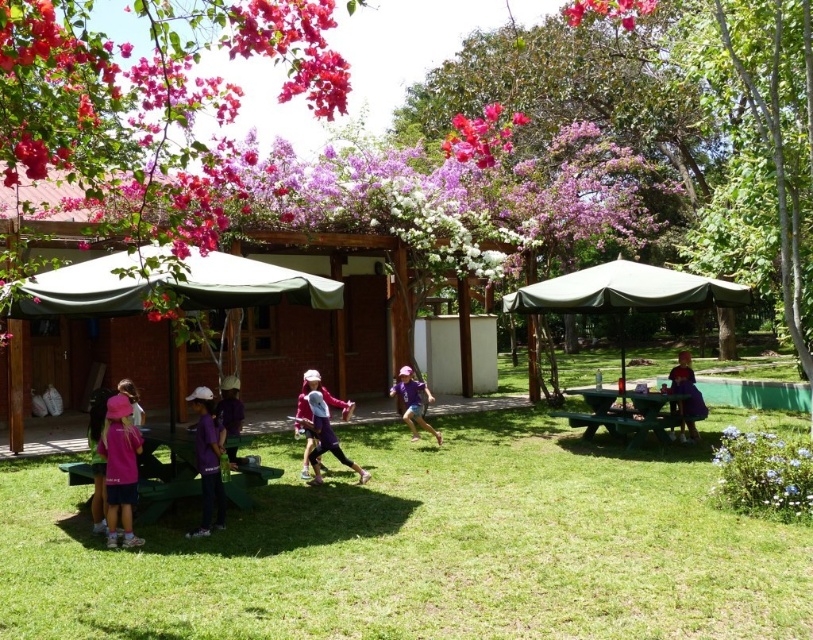
Question: Which of the following is the closest to the observer?

Choices:
 (A) (420, 410)
 (B) (616, 337)
 (C) (212, 474)

Answer: (C)

Question: Can you confirm if green plastic picnic table at lower left is bigger than purple matte shirt at center?

Choices:
 (A) no
 (B) yes

Answer: (A)

Question: Which point is closer to the camera?

Choices:
 (A) matte pink flowers at upper center
 (B) purple fabric at right

Answer: (A)

Question: Can you confirm if green fabric canopy at center is positioned to the left of purple fabric umbrella at lower left?

Choices:
 (A) yes
 (B) no

Answer: (A)

Question: Does green fabric canopy at right appear on the left side of vivid pink petals at upper center?

Choices:
 (A) yes
 (B) no

Answer: (B)

Question: Among these points, which one is nearest to the camera?

Choices:
 (A) [470, 141]
 (B) [250, 444]

Answer: (B)